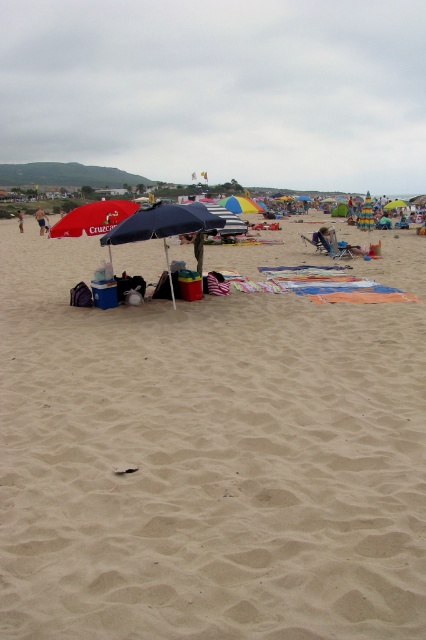
You are a geologist examining the beach. You notice two types of sand at the center of the beach. The first is smooth tan sand at center, and the second is beige sand at center. Which type of sand has larger grains?

The beige sand at center has larger grains because the smooth tan sand at center is smaller than beige sand at center.

You are a drone operator trying to capture a photo of the beach scene. The drone is currently positioned at point A, which is at coordinates 0.6, 0.5. You need to adjust the drone to focus on the smooth tan sand at center. Should you move the drone north or south to align with the sand?

The smooth tan sand at center is located at point (206, 461). Since the drone is at (213, 384), moving south would decrease the y coordinate from 0.5 to 0.484, so move south.